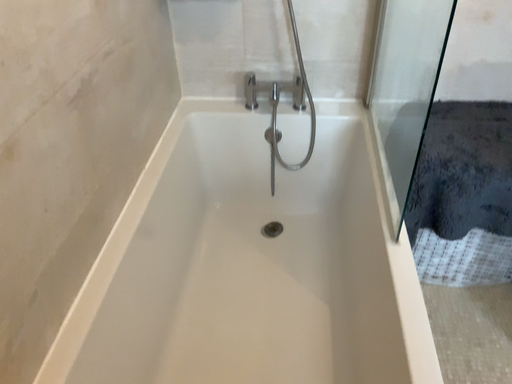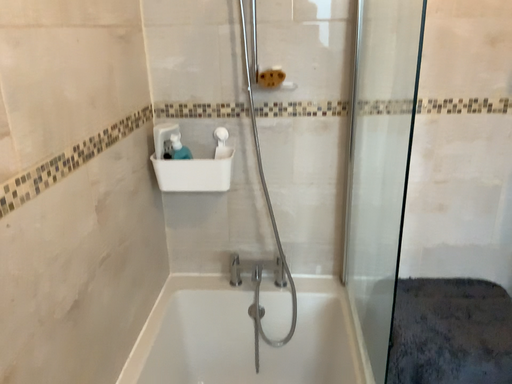
Question: How did the camera likely rotate when shooting the video?

Choices:
 (A) rotated upward
 (B) rotated downward

Answer: (A)